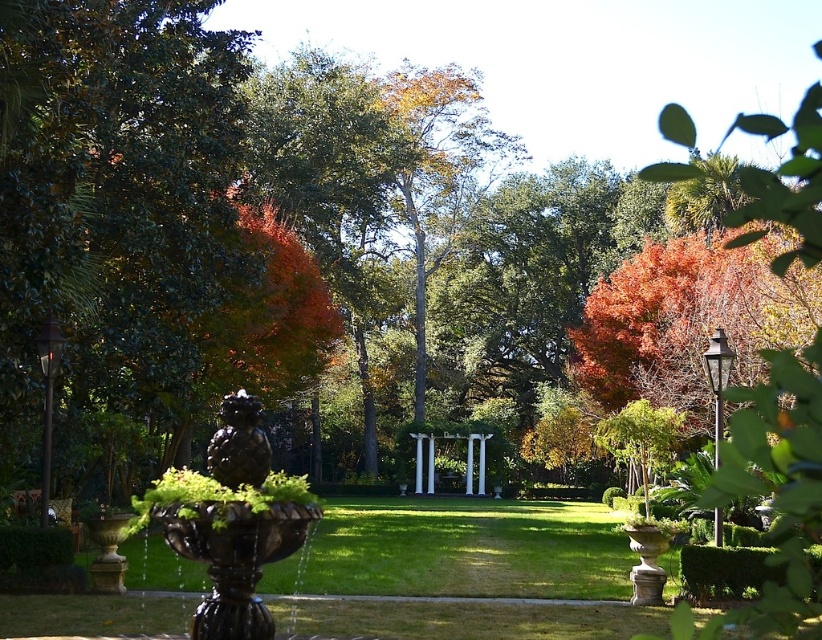
Looking at this image, can you confirm if green leafy tree at left is positioned above bronze statue at center?

Yes.

You are a GUI agent. You are given a task and a screenshot of the screen. Output one action in this format:
    pyautogui.click(x=<x>, y=<y>)
    Task: Click on the green leafy tree at left
    Image resolution: width=822 pixels, height=640 pixels.
    Given the screenshot: What is the action you would take?
    pyautogui.click(x=112, y=218)

Consider the image. Can you confirm if bronze/textured fountain at center is positioned to the left of bronze statue at center?

Incorrect, bronze/textured fountain at center is not on the left side of bronze statue at center.

Is bronze/textured fountain at center to the right of bronze statue at center from the viewer's perspective?

Yes, bronze/textured fountain at center is to the right of bronze statue at center.

Does point (289, 506) lie behind point (215, 448)?

That is False.

In order to click on bronze/textured fountain at center in this screenshot , I will do `click(231, 520)`.

Who is positioned more to the right, green leafy tree at left or bronze/textured fountain at center?

bronze/textured fountain at center is more to the right.

Does point (63, 355) lie in front of point (197, 612)?

No, (63, 355) is behind (197, 612).

Is point (118, 51) in front of point (218, 563)?

No, (118, 51) is further to viewer.

At what (x,y) coordinates should I click in order to perform the action: click on green leafy tree at left. Please return your answer as a coordinate pair (x, y). This screenshot has height=640, width=822. Looking at the image, I should click on (112, 218).